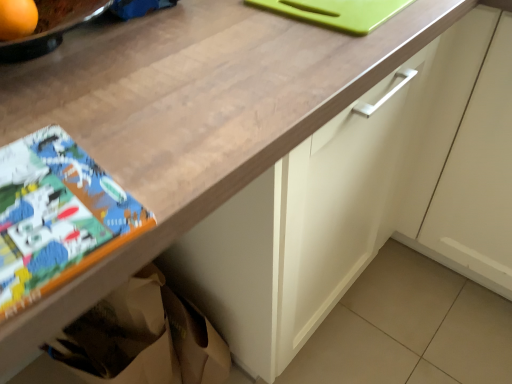
Question: From the image's perspective, is orange matte at upper left positioned above or below white matte cabinet at center?

Choices:
 (A) above
 (B) below

Answer: (A)

Question: Is orange matte at upper left in front of or behind white matte cabinet at center in the image?

Choices:
 (A) front
 (B) behind

Answer: (A)

Question: Estimate the real-world distances between objects in this image. Which object is closer to the white matte cabinet at center?

Choices:
 (A) matte paper comic book at lower left
 (B) orange matte at upper left

Answer: (A)

Question: Estimate the real-world distances between objects in this image. Which object is closer to the matte paper comic book at lower left?

Choices:
 (A) orange matte at upper left
 (B) white matte cabinet at center

Answer: (A)